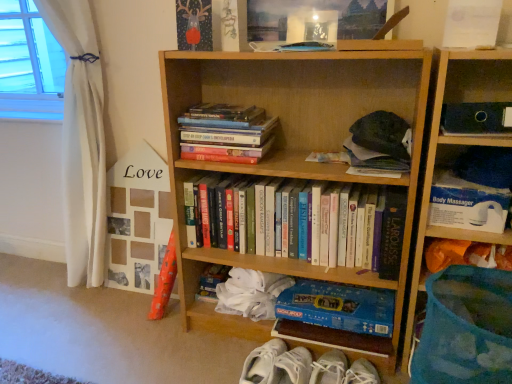
Question: Do you think hardcover book at upper center, which appears as the fourth book when ordered from the bottom, is within hardcover books at upper left, the 3th book from the bottom, or outside of it?

Choices:
 (A) inside
 (B) outside

Answer: (B)

Question: In terms of width, does hardcover book at upper center, which appears as the fourth book when ordered from the bottom, look wider or thinner when compared to hardcover books at upper left, which is counted as the second book, starting from the top?

Choices:
 (A) thin
 (B) wide

Answer: (A)

Question: Estimate the real-world distances between objects in this image. Which object is closer to the white fabric curtain at left?

Choices:
 (A) hardcover books at upper left, the 3th book from the bottom
 (B) blue cardboard monopoly game at lower center, which is counted as the 1th book, starting from the bottom
 (C) hardcover books at center, acting as the third book starting from the top
 (D) white plastic body massager at upper right
 (E) hardcover book at upper center, which appears as the first book when viewed from the top

Answer: (A)

Question: Estimate the real-world distances between objects in this image. Which object is closer to the hardcover books at center, acting as the third book starting from the top?

Choices:
 (A) matte black folder at upper right
 (B) hardcover book at upper center, which appears as the first book when viewed from the top
 (C) wooden bookcase at center, acting as the second bookcase starting from the right
 (D) blue cardboard monopoly game at lower center, which is counted as the 1th book, starting from the bottom
 (E) blue plastic basket at right, the first bookcase when ordered from right to left

Answer: (C)